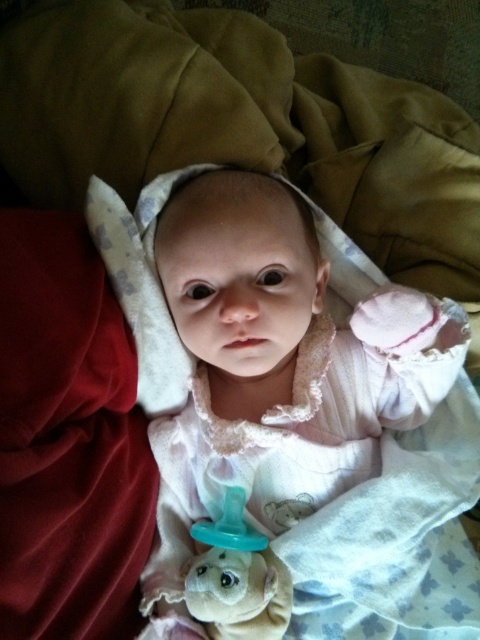
You are a photographer taking a picture of the white soft baby at center and the teal rubber pacifier at center. Which object will appear wider in the photo?

The white soft baby at center will appear wider in the photo since its width surpasses that of the teal rubber pacifier at center.

You are a photographer taking a picture of the baby. You want to focus on the white soft baby at center and the teal rubber pacifier at center. Which object should you adjust your focus on first if you want to ensure both are in focus?

The white soft baby at center is further to the viewer than the teal rubber pacifier at center, so you should focus on the white soft baby at center first to ensure both are in focus.